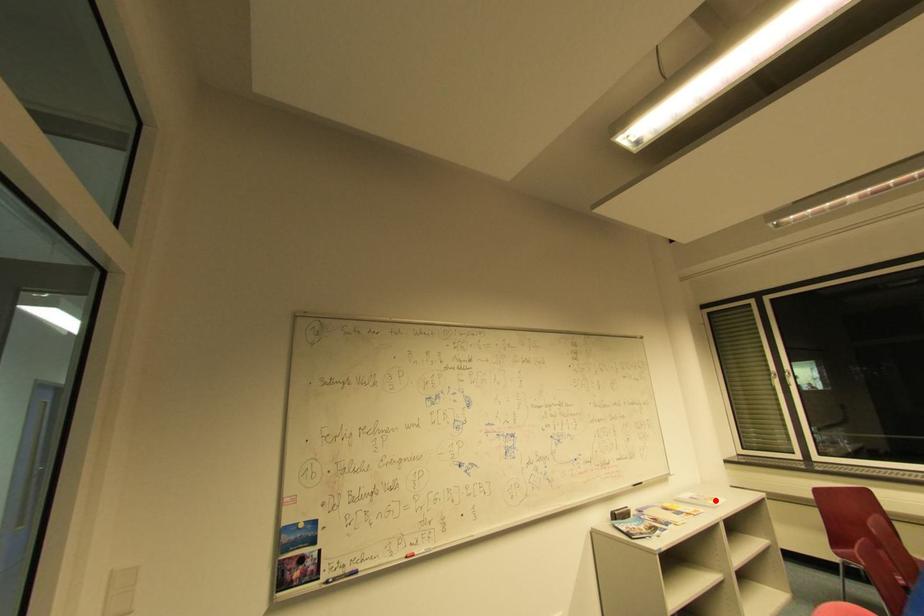
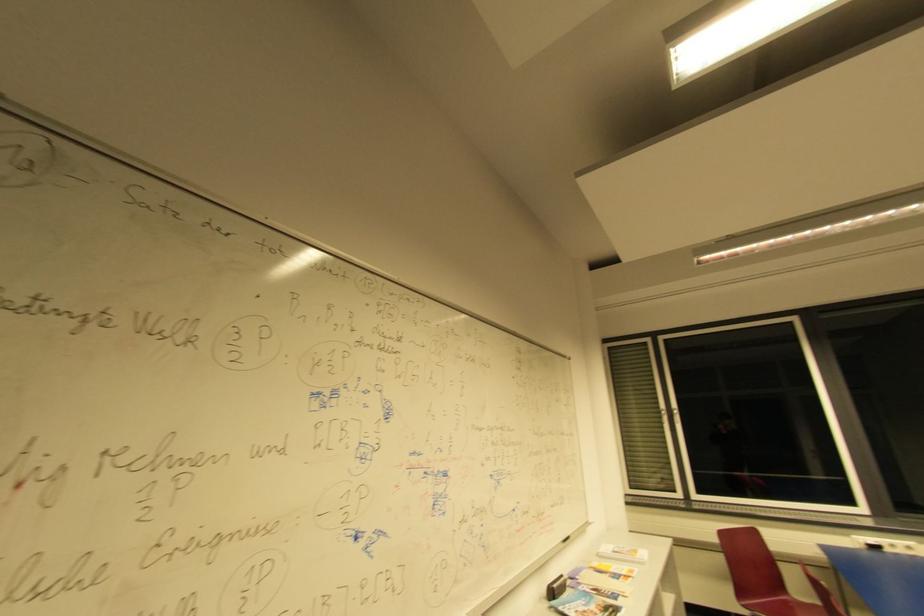
The point at the highlighted location is marked in the first image. Where is the corresponding point in the second image?

(640, 553)